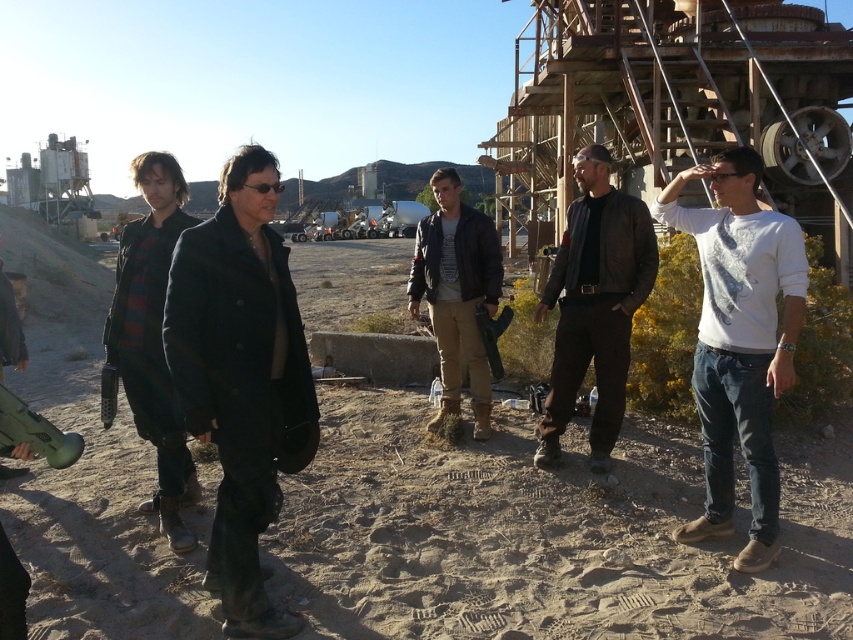
Does point (643, 625) come in front of point (785, 246)?

Yes, it is in front of point (785, 246).

Is point (691, 506) more distant than point (753, 458)?

That is True.

This screenshot has width=853, height=640. I want to click on dirt field at center, so pos(544,532).

Is black leather jacket at center above dark blue leather jacket at center?

Incorrect, black leather jacket at center is not positioned above dark blue leather jacket at center.

Looking at this image, can you confirm if black leather jacket at center is smaller than dark blue leather jacket at center?

Indeed, black leather jacket at center has a smaller size compared to dark blue leather jacket at center.

Between point (271, 436) and point (161, 352), which one is positioned in front?

Point (271, 436) is more forward.

Image resolution: width=853 pixels, height=640 pixels. Find the location of `black leather jacket at center`. black leather jacket at center is located at coordinates (241, 378).

Does black leather jacket at center come behind brown leather jacket at center?

No, black leather jacket at center is closer to the viewer.

Between black leather jacket at center and brown leather jacket at center, which one is positioned lower?

Positioned lower is black leather jacket at center.

The width and height of the screenshot is (853, 640). Identify the location of black leather jacket at center. pos(241,378).